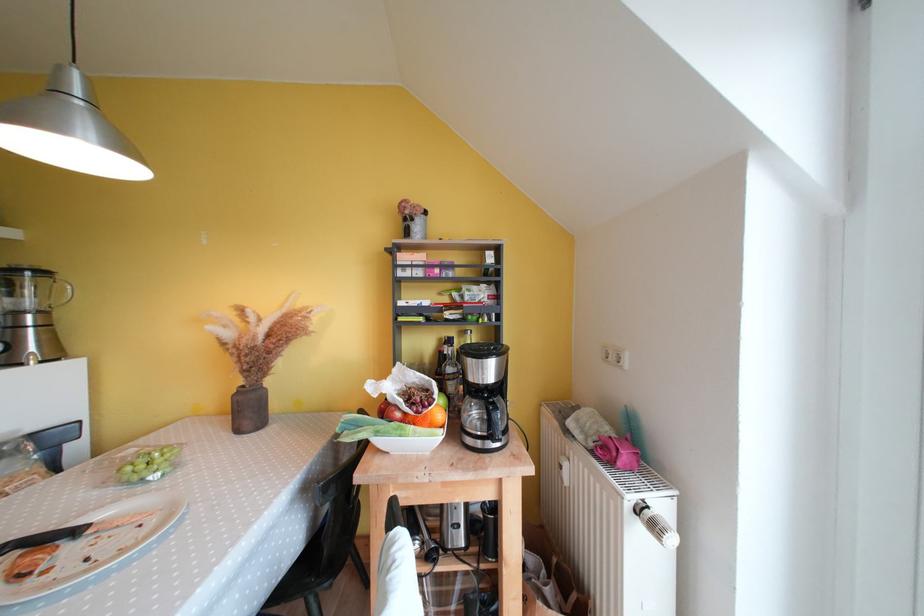
In order to click on silver blender dial in this screenshot , I will do `click(655, 525)`.